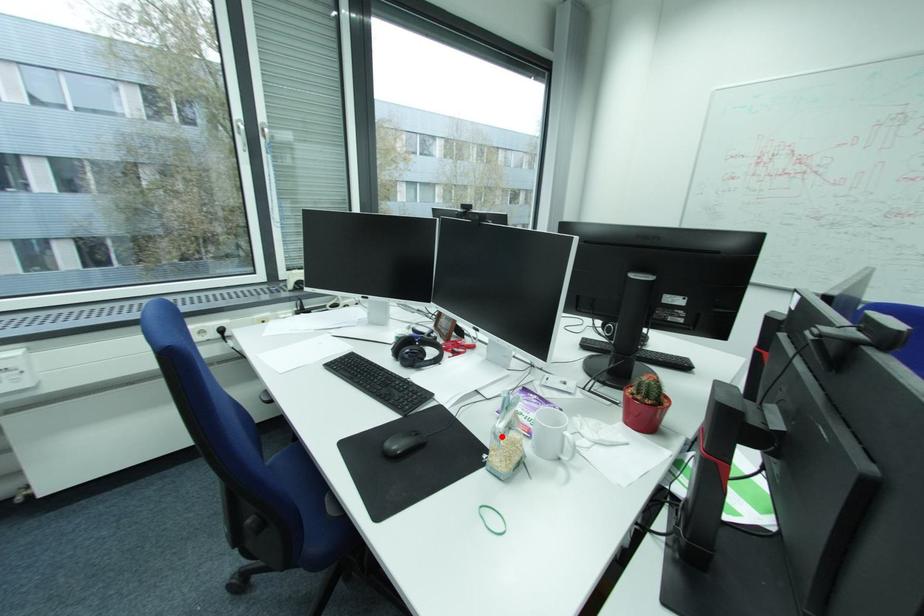
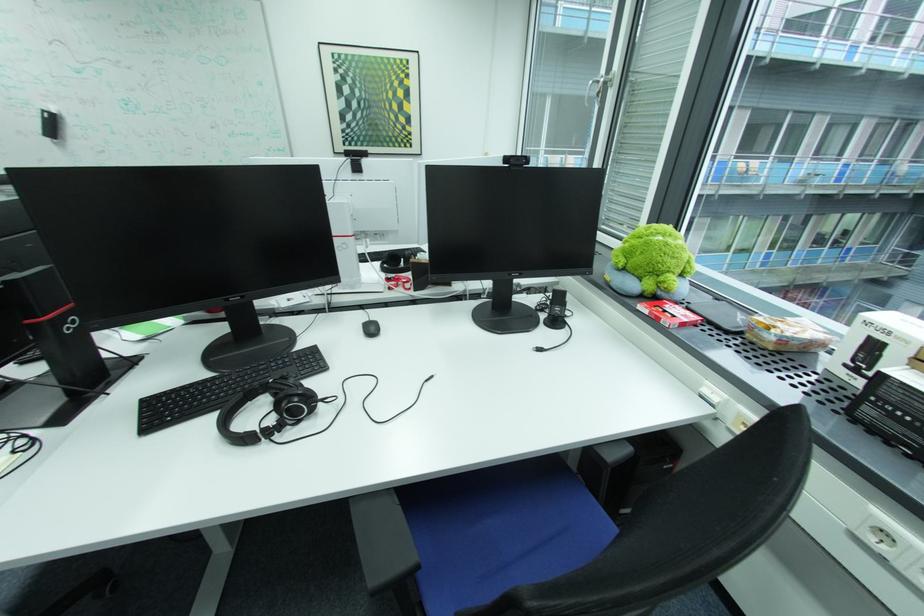
Question: I am providing you with two images of the same scene from different viewpoints. A red point is marked on the first image. At the location where the point appears in image 1, is it still visible in image 2?

Choices:
 (A) Yes
 (B) No

Answer: (B)